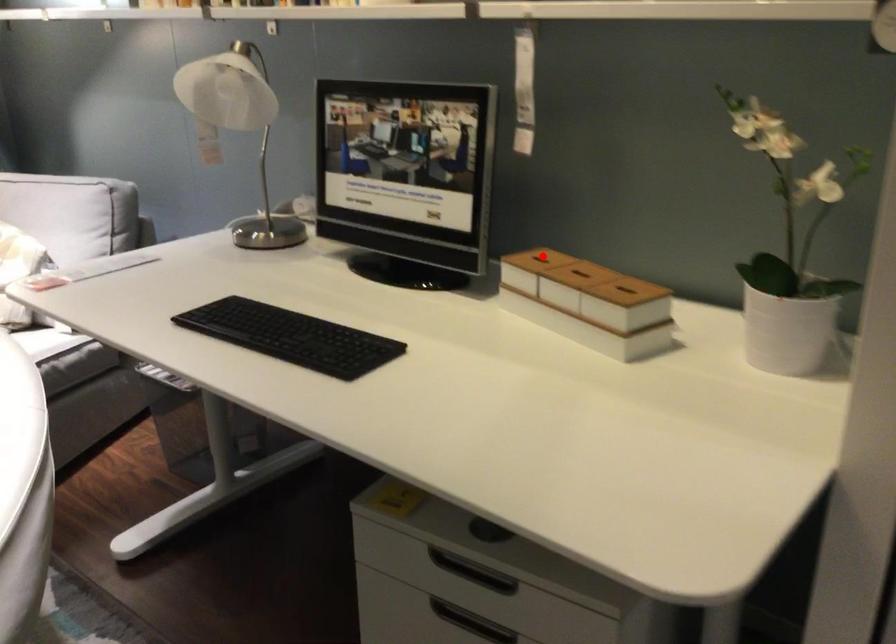
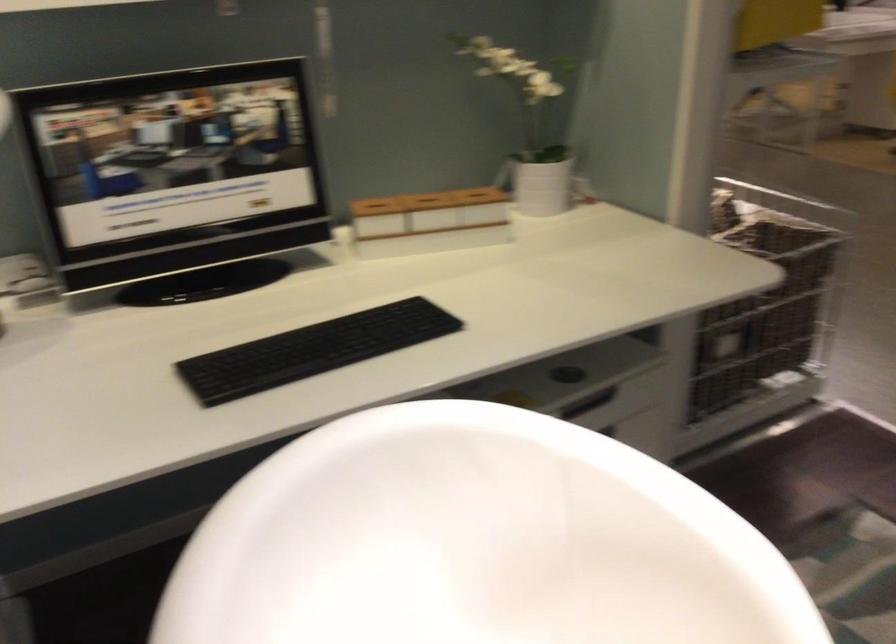
Question: A red point is marked in image1. In image2, is the corresponding 3D point closer to the camera or farther? Reply with the corresponding letter.

Choices:
 (A) The corresponding 3D point is closer.
 (B) The corresponding 3D point is farther.

Answer: (B)